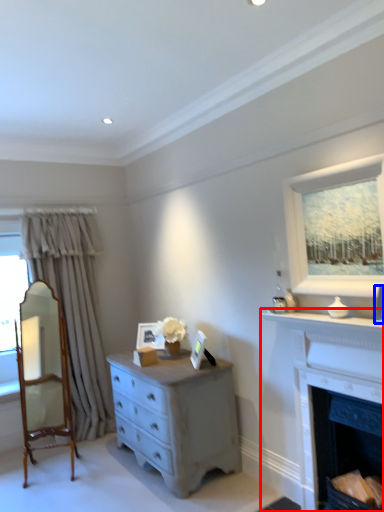
Question: Among these objects, which one is nearest to the camera, fireplace (highlighted by a red box) or picture frame (highlighted by a blue box)?

Choices:
 (A) fireplace
 (B) picture frame

Answer: (B)